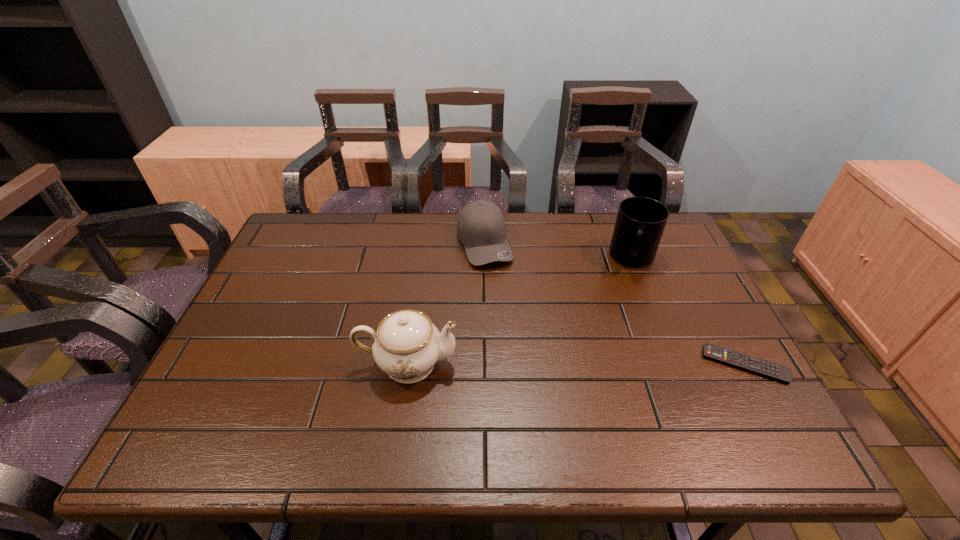
This screenshot has width=960, height=540. Find the location of `vacant space located 0.260m on the front brim of the second shortest object`. vacant space located 0.260m on the front brim of the second shortest object is located at coordinates pos(521,335).

Where is `vacant area situated 0.360m on the front brim of the second shortest object`? The image size is (960, 540). vacant area situated 0.360m on the front brim of the second shortest object is located at coordinates tap(535, 366).

At what (x,y) coordinates should I click in order to perform the action: click on vacant space located on the front brim of the second shortest object. Please return your answer as a coordinate pair (x, y). The height and width of the screenshot is (540, 960). Looking at the image, I should click on (534, 362).

You are a GUI agent. You are given a task and a screenshot of the screen. Output one action in this format:
    pyautogui.click(x=<x>, y=<y>)
    Task: Click on the mug present at the far edge
    
    Given the screenshot: What is the action you would take?
    pyautogui.click(x=640, y=222)

Image resolution: width=960 pixels, height=540 pixels. What are the coordinates of `baseball cap situated at the far edge` in the screenshot? It's located at (481, 227).

You are a GUI agent. You are given a task and a screenshot of the screen. Output one action in this format:
    pyautogui.click(x=<x>, y=<y>)
    Task: Click on the chinaware at the near edge
    
    Given the screenshot: What is the action you would take?
    pyautogui.click(x=407, y=345)

Locate an element on the screen. This screenshot has width=960, height=540. remote control located in the near edge section of the desktop is located at coordinates (741, 361).

Locate an element on the screen. remote control present at the right edge is located at coordinates tap(741, 361).

Locate an element on the screen. This screenshot has height=540, width=960. mug positioned at the right edge is located at coordinates (640, 222).

Image resolution: width=960 pixels, height=540 pixels. I want to click on object present at the far right corner, so point(640,222).